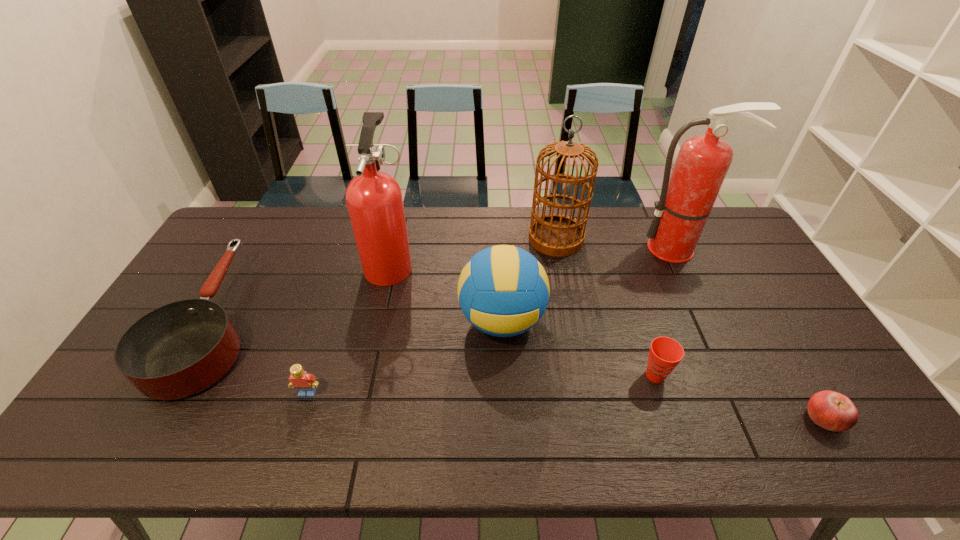
Where is `object positioned at the left edge`? Image resolution: width=960 pixels, height=540 pixels. object positioned at the left edge is located at coordinates (177, 350).

At what (x,y) coordinates should I click in order to perform the action: click on fire extinguisher present at the right edge. Please return your answer as a coordinate pair (x, y). The image size is (960, 540). Looking at the image, I should click on (686, 200).

Locate an element on the screen. The image size is (960, 540). apple at the right edge is located at coordinates (833, 411).

Locate an element on the screen. The image size is (960, 540). object that is at the far right corner is located at coordinates (686, 200).

You are a GUI agent. You are given a task and a screenshot of the screen. Output one action in this format:
    pyautogui.click(x=<x>, y=<y>)
    Task: Click on the object that is at the near right corner
    
    Given the screenshot: What is the action you would take?
    pyautogui.click(x=833, y=411)

In the image, there is a desktop. Identify the location of vacant area at the far edge. (606, 221).

The image size is (960, 540). Find the location of `blank space at the left edge of the desktop`. blank space at the left edge of the desktop is located at coordinates (193, 281).

Identify the location of free location at the right edge. (792, 354).

Locate an element on the screen. free region at the far left corner of the desktop is located at coordinates (228, 237).

This screenshot has height=540, width=960. I want to click on free location at the far right corner, so click(x=725, y=210).